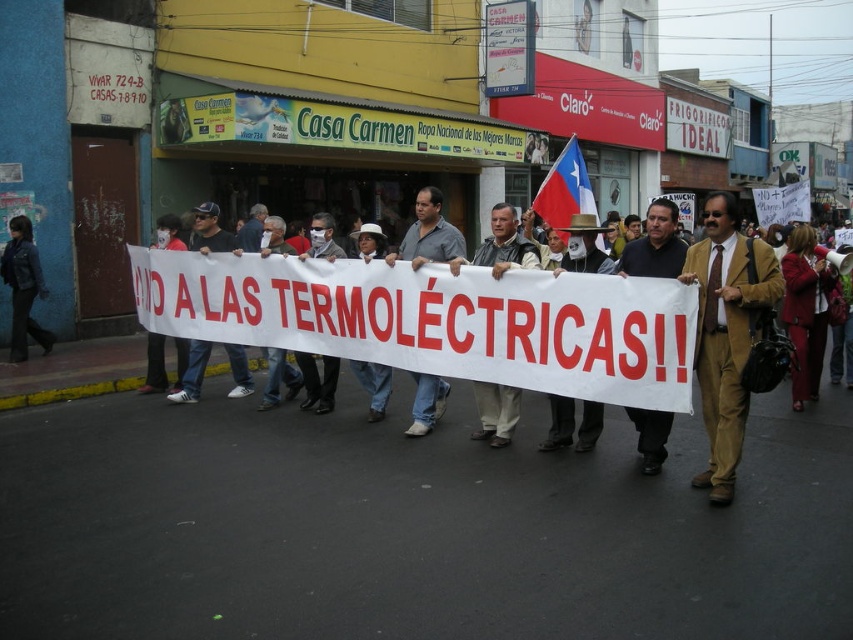
Is point (743, 282) more distant than point (701, 371)?

That is False.

The height and width of the screenshot is (640, 853). I want to click on brown leather jacket at center, so click(505, 324).

Which is above, khaki cotton pants at center or blue and white fabric flag at center?

Positioned higher is blue and white fabric flag at center.

Is khaki cotton pants at center to the right of blue and white fabric flag at center from the viewer's perspective?

No, khaki cotton pants at center is not to the right of blue and white fabric flag at center.

At what (x,y) coordinates should I click in order to perform the action: click on khaki cotton pants at center. Please return your answer as a coordinate pair (x, y). The width and height of the screenshot is (853, 640). Looking at the image, I should click on (584, 248).

You are a GUI agent. You are given a task and a screenshot of the screen. Output one action in this format:
    pyautogui.click(x=<x>, y=<y>)
    Task: Click on the khaki cotton pants at center
    The height and width of the screenshot is (640, 853).
    Given the screenshot: What is the action you would take?
    pyautogui.click(x=584, y=248)

Can you confirm if brown leather jacket at center is shorter than dark blue leather jacket at left?

Indeed, brown leather jacket at center has a lesser height compared to dark blue leather jacket at left.

Between brown leather jacket at center and dark blue leather jacket at left, which one has more height?

dark blue leather jacket at left is taller.

Does point (527, 294) lie behind point (15, 340)?

No, (527, 294) is closer to viewer.

At what (x,y) coordinates should I click in order to perform the action: click on brown leather jacket at center. Please return your answer as a coordinate pair (x, y). The width and height of the screenshot is (853, 640). Looking at the image, I should click on (505, 324).